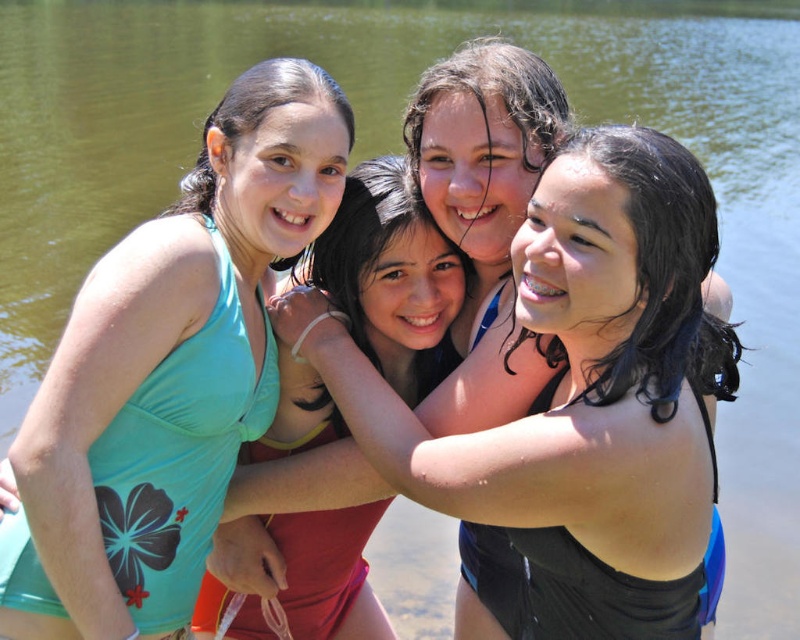
Question: Does teal fabric bikini top at center come in front of black matte swimsuit at center?

Choices:
 (A) no
 (B) yes

Answer: (A)

Question: Which point is closer to the camera taking this photo?

Choices:
 (A) (378, 241)
 (B) (524, 253)
 (C) (54, 557)

Answer: (C)

Question: Which of the following is the closest to the observer?

Choices:
 (A) light blue fabric swimsuit at upper left
 (B) teal fabric bikini top at center
 (C) matte black swimsuit at center
 (D) black matte swimsuit at center

Answer: (C)

Question: Does matte black swimsuit at center appear on the left side of teal fabric bikini top at center?

Choices:
 (A) no
 (B) yes

Answer: (A)

Question: Estimate the real-world distances between objects in this image. Which object is closer to the light blue fabric swimsuit at upper left?

Choices:
 (A) black matte swimsuit at center
 (B) matte black swimsuit at center

Answer: (B)

Question: Is matte black swimsuit at center above light blue fabric swimsuit at upper left?

Choices:
 (A) no
 (B) yes

Answer: (A)